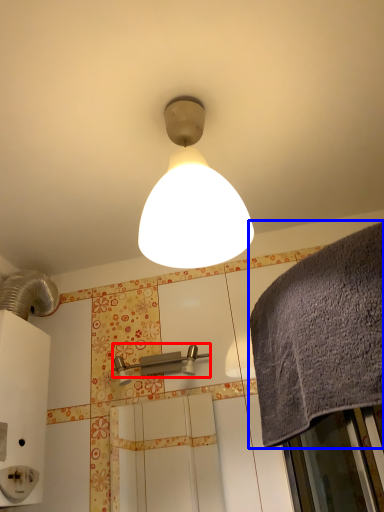
Question: Which point is further to the camera, shower (highlighted by a red box) or bath towel (highlighted by a blue box)?

Choices:
 (A) shower
 (B) bath towel

Answer: (A)